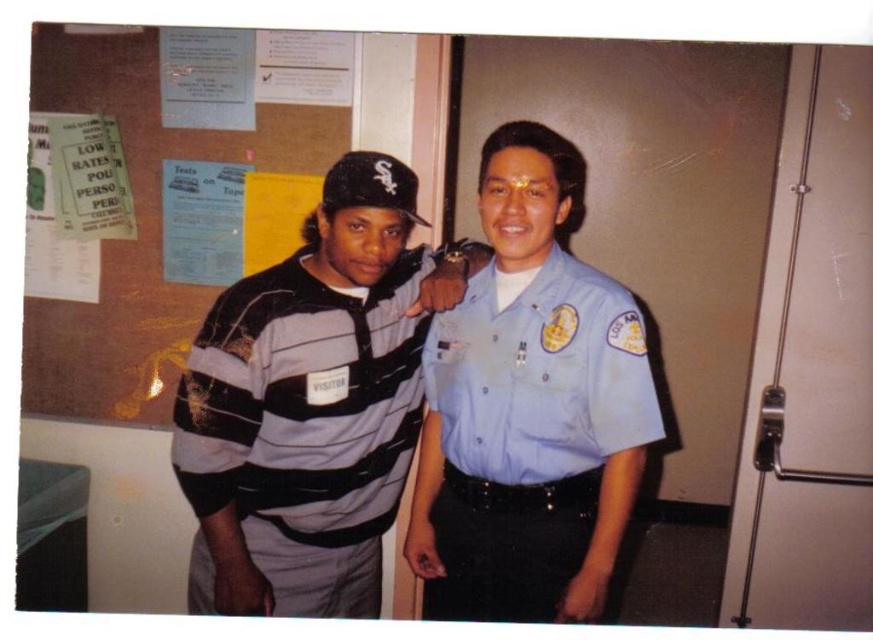
Question: Can you confirm if burlap bulletin board at upper left is positioned below light blue fabric shirt at center?

Choices:
 (A) no
 (B) yes

Answer: (A)

Question: Which of the following is the closest to the observer?

Choices:
 (A) light blue fabric shirt at center
 (B) striped knit sweater at center
 (C) burlap bulletin board at upper left

Answer: (A)

Question: Which point is farther to the camera?

Choices:
 (A) (325, 339)
 (B) (232, 96)

Answer: (B)

Question: Can you confirm if burlap bulletin board at upper left is positioned to the left of light blue fabric shirt at center?

Choices:
 (A) no
 (B) yes

Answer: (B)

Question: Which point appears closest to the camera in this image?

Choices:
 (A) (273, 378)
 (B) (575, 426)
 (C) (376, 51)

Answer: (B)

Question: Does striped knit sweater at center have a greater width compared to light blue fabric shirt at center?

Choices:
 (A) no
 (B) yes

Answer: (B)